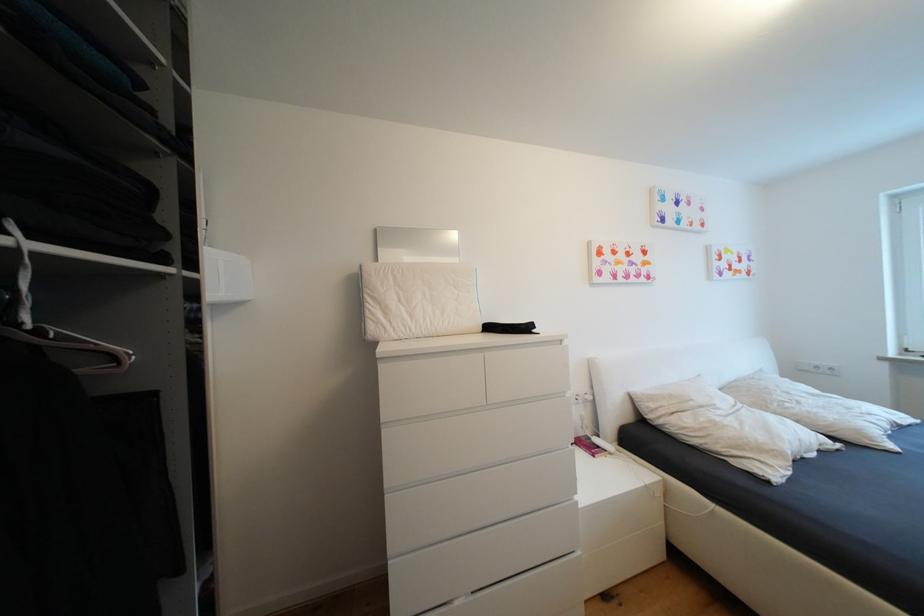
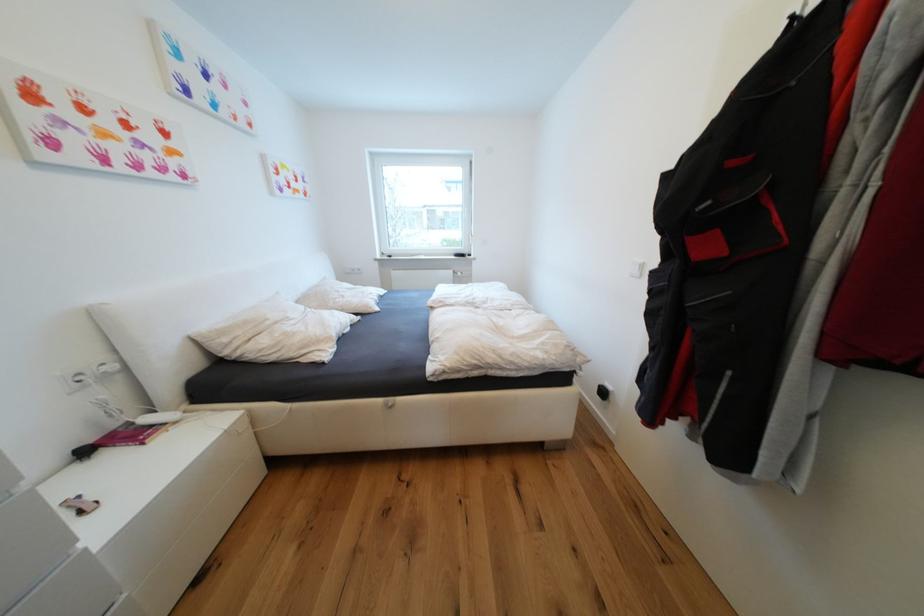
The point at [604,448] is marked in the first image. Where is the corresponding point in the second image?

(159, 428)